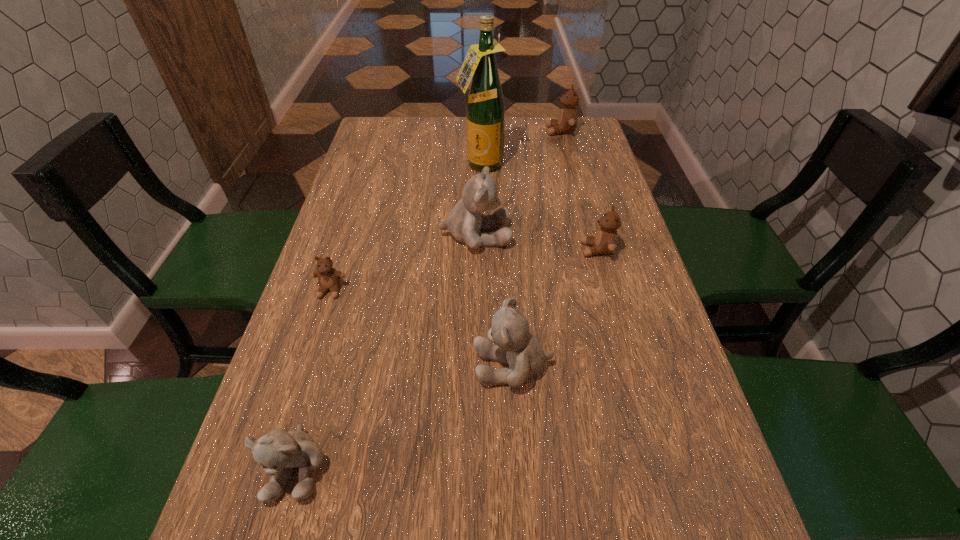
I want to click on the nearest gray teddy bear, so click(x=277, y=451).

Find the location of a particular element. the smallest brown teddy bear is located at coordinates (329, 278).

Identify the location of the fifth farthest object. (329, 278).

The width and height of the screenshot is (960, 540). I want to click on blank space located on the front-facing side of the liquor, so click(481, 196).

What are the coordinates of `free space located on the face of the farthest gray teddy bear` in the screenshot? It's located at (631, 236).

Locate an element on the screen. The height and width of the screenshot is (540, 960). free space located on the front-facing side of the biggest brown teddy bear is located at coordinates (430, 131).

I want to click on blank space located 0.400m on the front-facing side of the biggest brown teddy bear, so click(426, 131).

The height and width of the screenshot is (540, 960). Identify the location of vacant space located 0.190m on the front-facing side of the biggest brown teddy bear. (490, 131).

The height and width of the screenshot is (540, 960). Identify the location of free space located on the face of the second nearest teddy bear. (416, 366).

Where is `free location located 0.230m on the face of the second nearest teddy bear`? The width and height of the screenshot is (960, 540). free location located 0.230m on the face of the second nearest teddy bear is located at coordinates (353, 366).